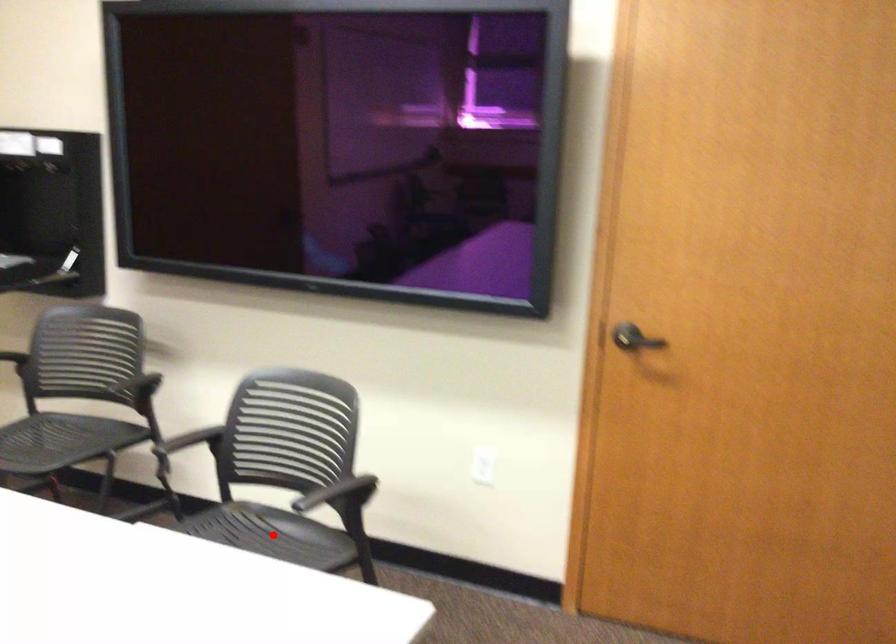
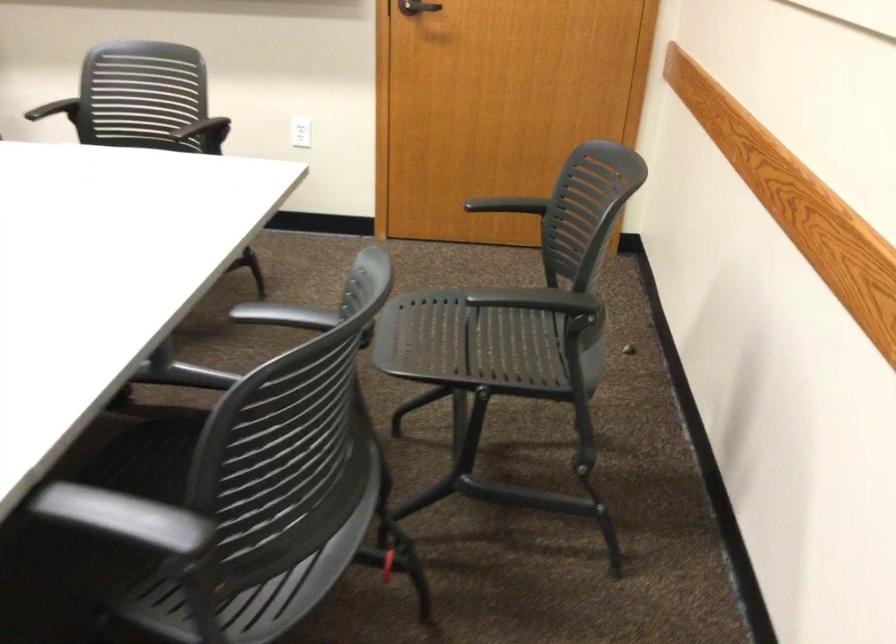
Question: I am providing you with two images of the same scene from different viewpoints. A red point is marked on the first image. Is the red point's position out of view in image 2?

Choices:
 (A) Yes
 (B) No

Answer: (A)